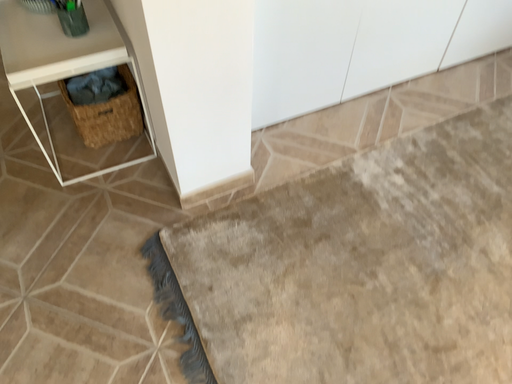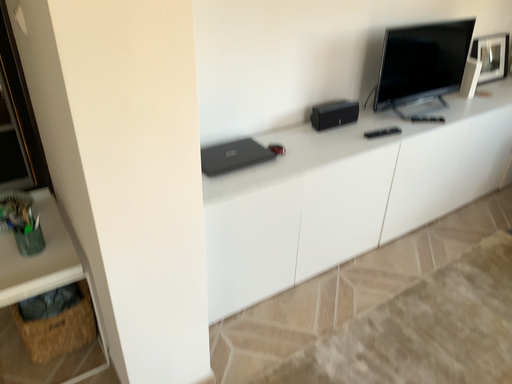
Question: Which way did the camera rotate in the video?

Choices:
 (A) rotated downward
 (B) rotated upward

Answer: (B)